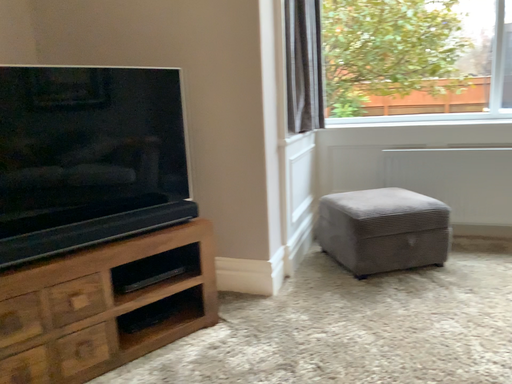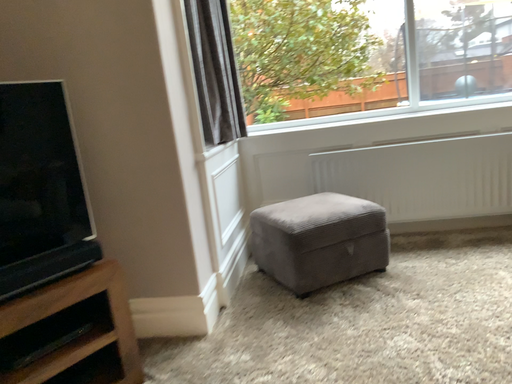
Question: How did the camera likely rotate when shooting the video?

Choices:
 (A) rotated right
 (B) rotated left

Answer: (A)